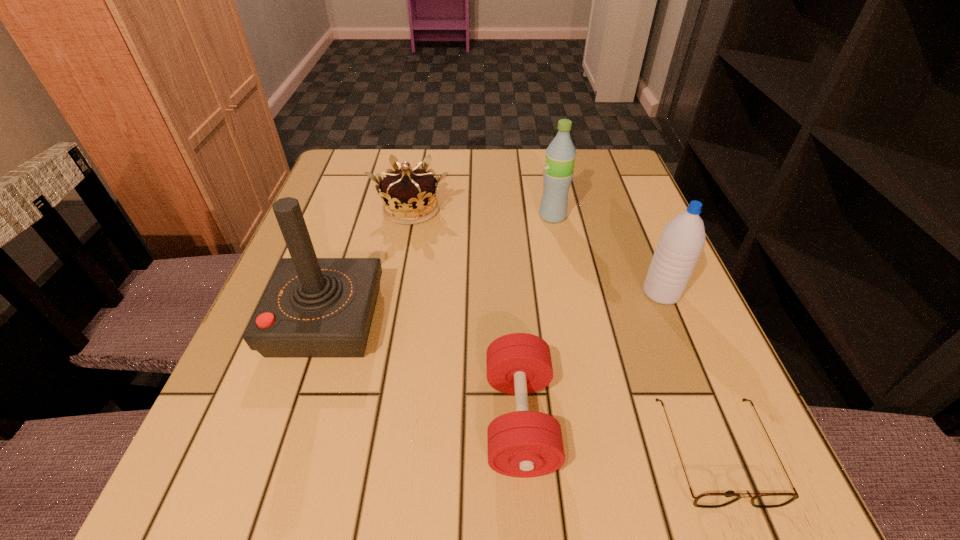
This screenshot has height=540, width=960. I want to click on vacant space that satisfies the following two spatial constraints: 1. on the rectangular base of the fifth tallest object; 2. on the left side of the joystick, so click(x=294, y=420).